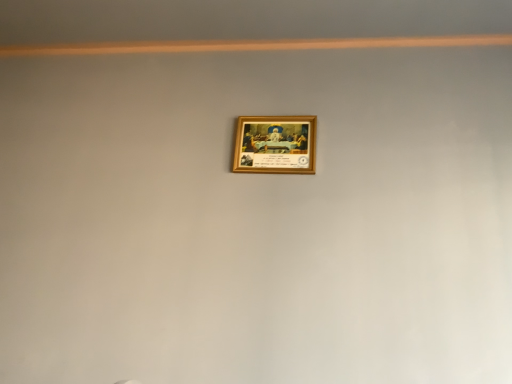
Consider the image. What is the approximate width of gold wooden picture frame at center?

It is 1.20 inches.

The height and width of the screenshot is (384, 512). Describe the element at coordinates (275, 144) in the screenshot. I see `gold wooden picture frame at center` at that location.

The width and height of the screenshot is (512, 384). I want to click on gold wooden picture frame at center, so click(x=275, y=144).

This screenshot has width=512, height=384. What are the coordinates of `gold wooden picture frame at center` in the screenshot? It's located at (275, 144).